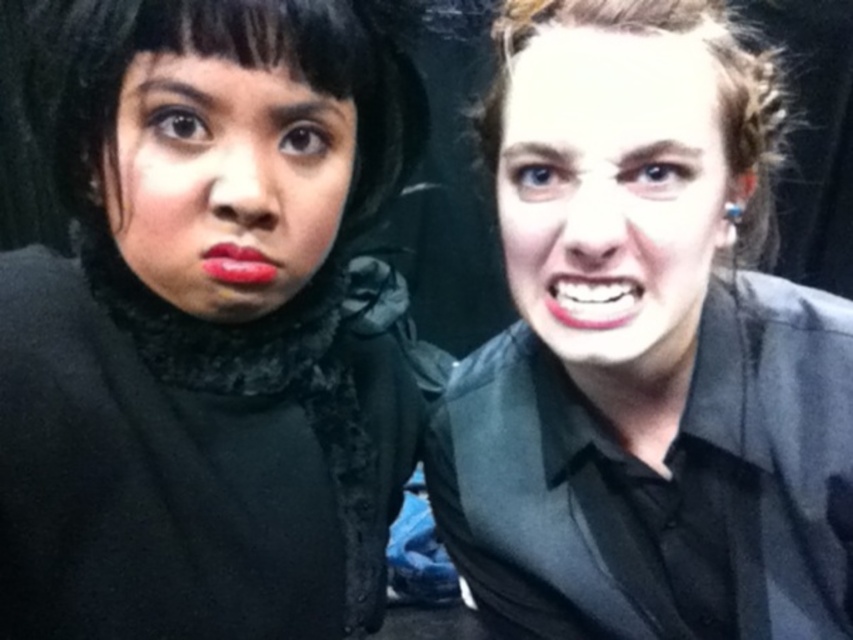
Question: Which object is the closest to the black lace top at upper left?

Choices:
 (A) smooth skin face at right
 (B) white glossy teeth at center

Answer: (A)

Question: Considering the real-world distances, which object is farthest from the matte black face at upper left?

Choices:
 (A) white glossy teeth at center
 (B) black lace top at upper left

Answer: (A)

Question: Is smooth skin face at right closer to the viewer compared to matte red lips at center?

Choices:
 (A) no
 (B) yes

Answer: (B)

Question: Is matte black face at upper left to the left of matte red lips at center from the viewer's perspective?

Choices:
 (A) yes
 (B) no

Answer: (B)

Question: In this image, where is matte black face at upper left located relative to matte red lips at center?

Choices:
 (A) left
 (B) right

Answer: (B)

Question: Estimate the real-world distances between objects in this image. Which object is closer to the matte red lips at center?

Choices:
 (A) black matte shirt at right
 (B) smooth skin face at right
 (C) white glossy teeth at center

Answer: (C)